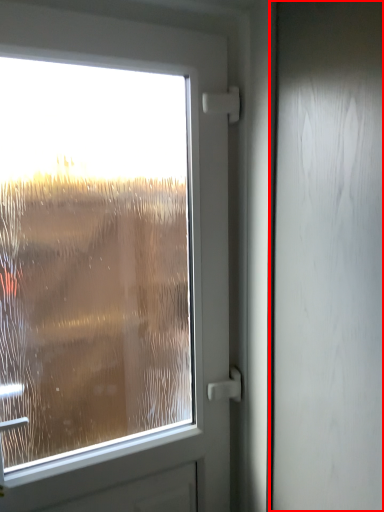
Question: From the image, what is the correct spatial relationship of screen door (annotated by the red box) in relation to airplane window?

Choices:
 (A) left
 (B) right

Answer: (B)